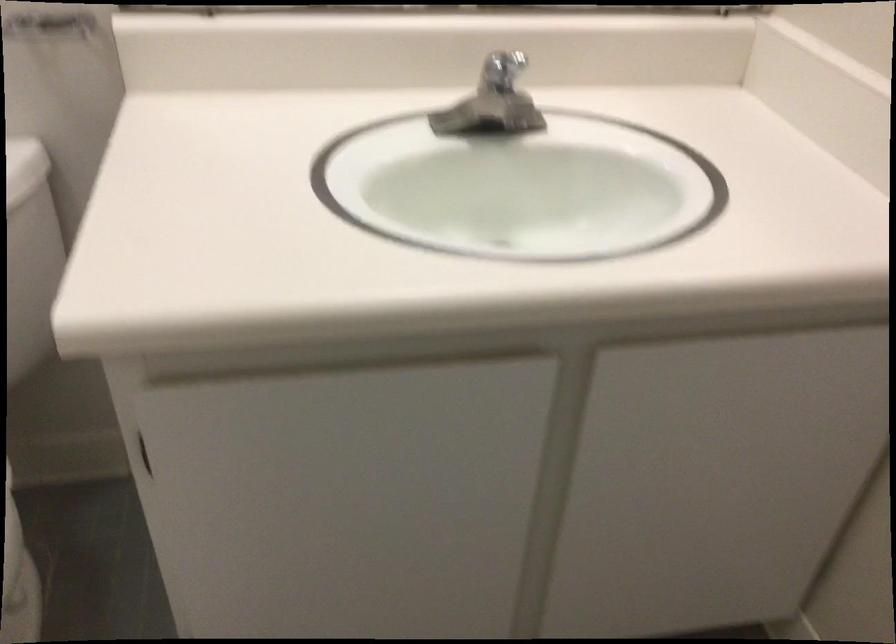
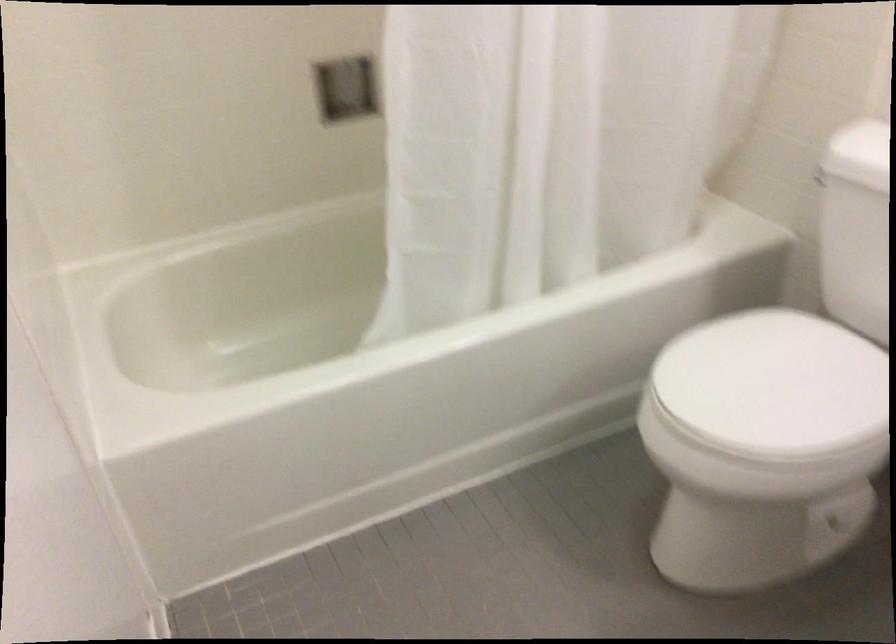
Based on the photo, based on the continuous images, in which direction is the camera rotating?

The rotation direction of the camera is left-down.